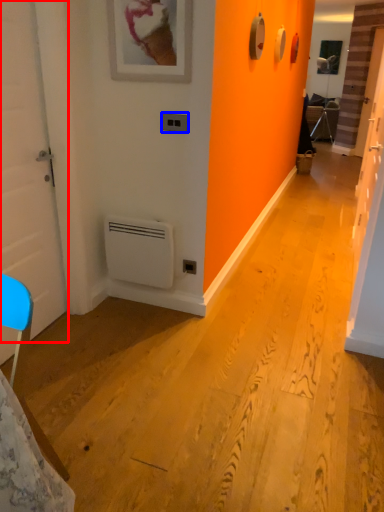
Question: Which point is closer to the camera, door (highlighted by a red box) or light switch (highlighted by a blue box)?

Choices:
 (A) door
 (B) light switch

Answer: (A)